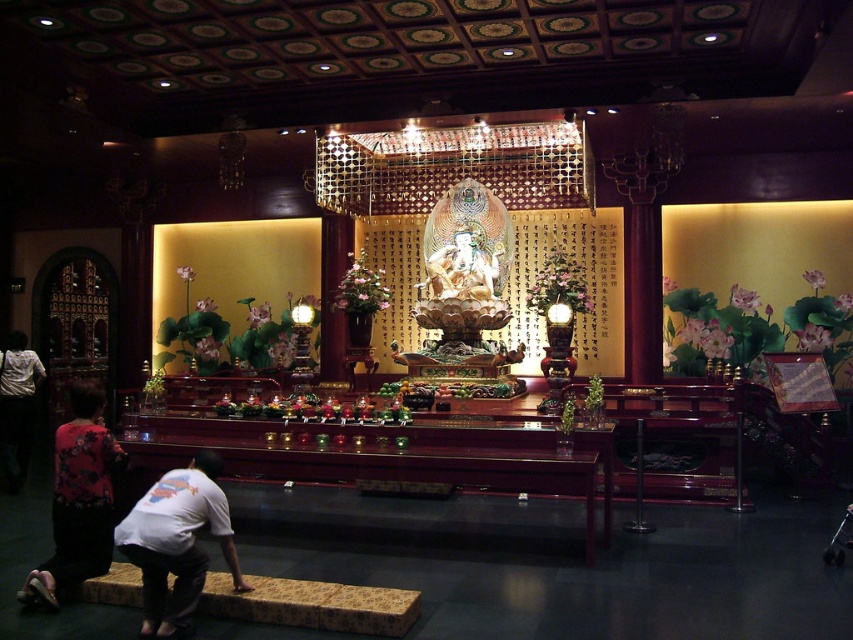
Question: Is white cotton shirt at lower center smaller than floral-patterned fabric at lower left?

Choices:
 (A) yes
 (B) no

Answer: (B)

Question: Which object is closer to the camera taking this photo?

Choices:
 (A) floral-patterned fabric at lower left
 (B) white cotton shirt at lower center

Answer: (B)

Question: Does white cotton shirt at lower center have a smaller size compared to floral-patterned fabric at lower left?

Choices:
 (A) no
 (B) yes

Answer: (A)

Question: Does white cotton shirt at lower center appear under floral-patterned fabric at lower left?

Choices:
 (A) no
 (B) yes

Answer: (B)

Question: Which of the following is the closest to the observer?

Choices:
 (A) (167, 483)
 (B) (64, 570)

Answer: (A)

Question: Which point is farther to the camera?

Choices:
 (A) (154, 596)
 (B) (108, 490)

Answer: (B)